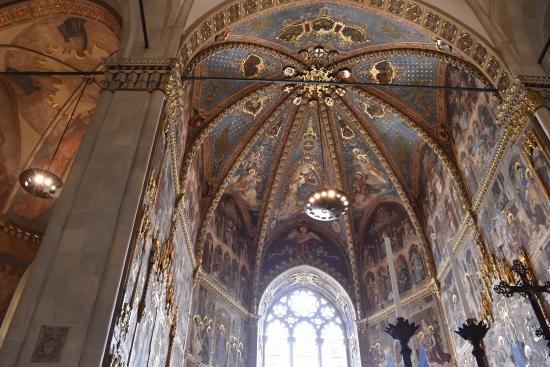
Where is `lamp`? This screenshot has width=550, height=367. lamp is located at coordinates (40, 172), (331, 206).